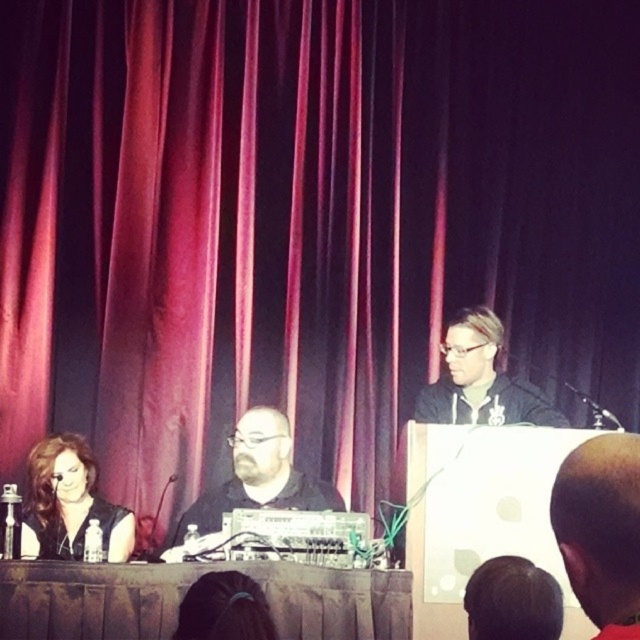
Looking at this image, who is shorter, brown fabric table at center or matte black hoodie at center?

Standing shorter between the two is brown fabric table at center.

Which is behind, point (80, 577) or point (492, 406)?

Positioned behind is point (492, 406).

At what (x,y) coordinates should I click in order to perform the action: click on brown fabric table at center. Please return your answer as a coordinate pair (x, y). Looking at the image, I should click on (184, 593).

Can you confirm if bald head at center is positioned below matte black hoodie at center?

Actually, bald head at center is above matte black hoodie at center.

Between point (632, 544) and point (474, 380), which one is positioned in front?

Point (632, 544) is more forward.

Find the location of `bald head at center`. bald head at center is located at coordinates (600, 528).

Does black matte shirt at center appear on the left side of shiny black hair at lower left?

Incorrect, black matte shirt at center is not on the left side of shiny black hair at lower left.

Is the position of black matte shirt at center more distant than that of shiny black hair at lower left?

Yes, black matte shirt at center is behind shiny black hair at lower left.

Who is more distant from viewer, (x=317, y=506) or (x=60, y=502)?

Point (x=317, y=506)

At what (x,y) coordinates should I click in order to perform the action: click on black matte shirt at center. Please return your answer as a coordinate pair (x, y). Image resolution: width=640 pixels, height=640 pixels. Looking at the image, I should click on (253, 481).